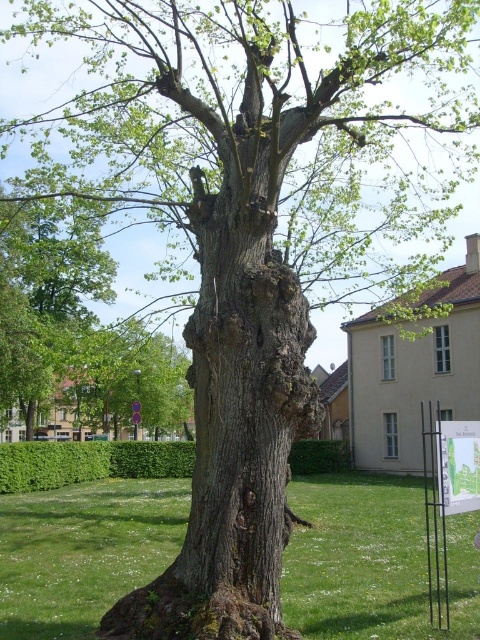
This screenshot has width=480, height=640. Find the location of `green grass at center`. green grass at center is located at coordinates (372, 561).

Locate an element on the screen. This screenshot has width=480, height=640. green grass at center is located at coordinates (372, 561).